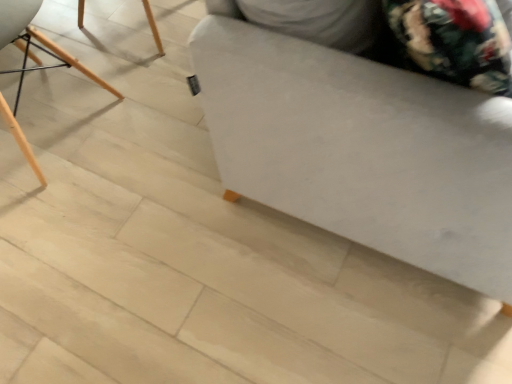
Question: Should I look upward or downward to see wooden chair at left?

Choices:
 (A) up
 (B) down

Answer: (A)

Question: Is wooden chair at left surrounding white fabric ottoman at center?

Choices:
 (A) yes
 (B) no

Answer: (B)

Question: Is wooden chair at left in contact with white fabric ottoman at center?

Choices:
 (A) no
 (B) yes

Answer: (A)

Question: Considering the relative sizes of wooden chair at left and white fabric ottoman at center in the image provided, is wooden chair at left shorter than white fabric ottoman at center?

Choices:
 (A) no
 (B) yes

Answer: (B)

Question: Is wooden chair at left not within white fabric ottoman at center?

Choices:
 (A) yes
 (B) no

Answer: (A)

Question: From a real-world perspective, is wooden chair at left located beneath white fabric ottoman at center?

Choices:
 (A) yes
 (B) no

Answer: (A)

Question: Is white fabric ottoman at center at the back of wooden chair at left?

Choices:
 (A) no
 (B) yes

Answer: (B)

Question: Considering the relative sizes of white fabric ottoman at center and wooden chair at left in the image provided, is white fabric ottoman at center bigger than wooden chair at left?

Choices:
 (A) yes
 (B) no

Answer: (A)

Question: From a real-world perspective, is white fabric ottoman at center located higher than wooden chair at left?

Choices:
 (A) yes
 (B) no

Answer: (A)

Question: Can you confirm if white fabric ottoman at center is shorter than wooden chair at left?

Choices:
 (A) no
 (B) yes

Answer: (A)

Question: Is white fabric ottoman at center to the right of wooden chair at left from the viewer's perspective?

Choices:
 (A) no
 (B) yes

Answer: (B)

Question: Considering the relative sizes of white fabric ottoman at center and wooden chair at left in the image provided, is white fabric ottoman at center thinner than wooden chair at left?

Choices:
 (A) yes
 (B) no

Answer: (B)

Question: Does white fabric ottoman at center turn towards wooden chair at left?

Choices:
 (A) no
 (B) yes

Answer: (A)

Question: Is wooden chair at left to the left or to the right of white fabric ottoman at center in the image?

Choices:
 (A) right
 (B) left

Answer: (B)